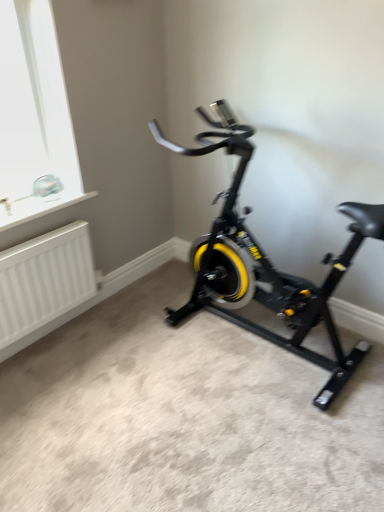
In order to click on blank area beneath white matte radiator at lower left (from a real-world perspective) in this screenshot , I will do `click(58, 335)`.